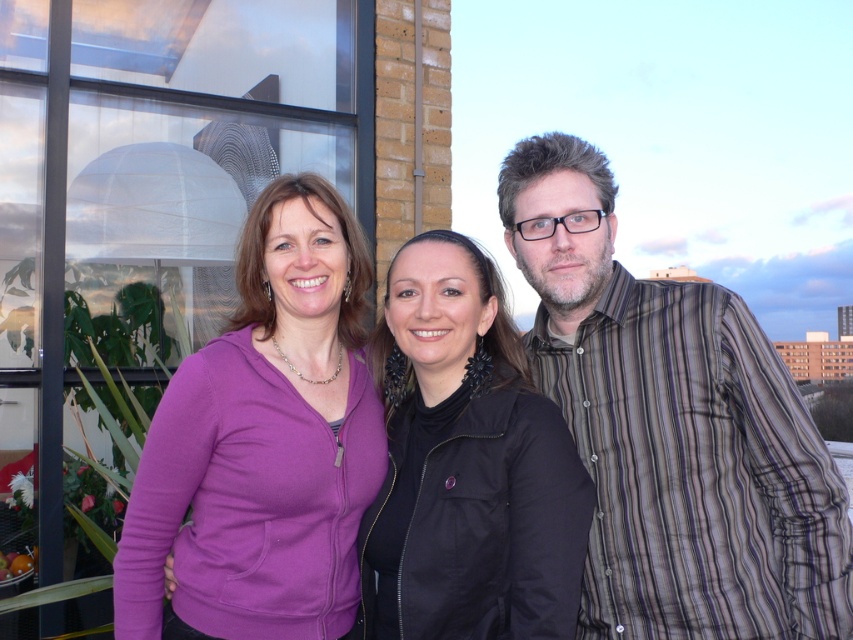
You are a photographer setting up a tripod to take a group photo of the striped cotton shirt at right and the black fabric jacket at center. You want to ensure both subjects are in focus. Given their heights, which subject should you adjust the camera focus on first to account for depth of field?

The striped cotton shirt at right is much taller than the black fabric jacket at center. To account for depth of field, focus on the taller subject first, so adjust the camera focus on the striped cotton shirt at right first.

You are a photographer trying to capture a group photo of the striped cotton shirt at right and the black fabric jacket at center. The camera has a maximum width capacity of 1.2 meters. Can both subjects fit within the camera frame if they stand side by side?

The striped cotton shirt at right is wider than the black fabric jacket at center. However, without knowing the exact widths of both subjects, it is impossible to determine if their combined width exceeds the camera frame of 1.2 meters. Additional measurements are needed to confirm.

You are a photographer trying to capture a group photo of the purple fleece jacket at center and the black fabric jacket at center. You need to ensure that both jackets are fully visible in the frame. Given that the camera has a fixed width, which jacket requires more space horizontally to be fully captured?

The purple fleece jacket at center requires more horizontal space because its width surpasses that of the black fabric jacket at center.